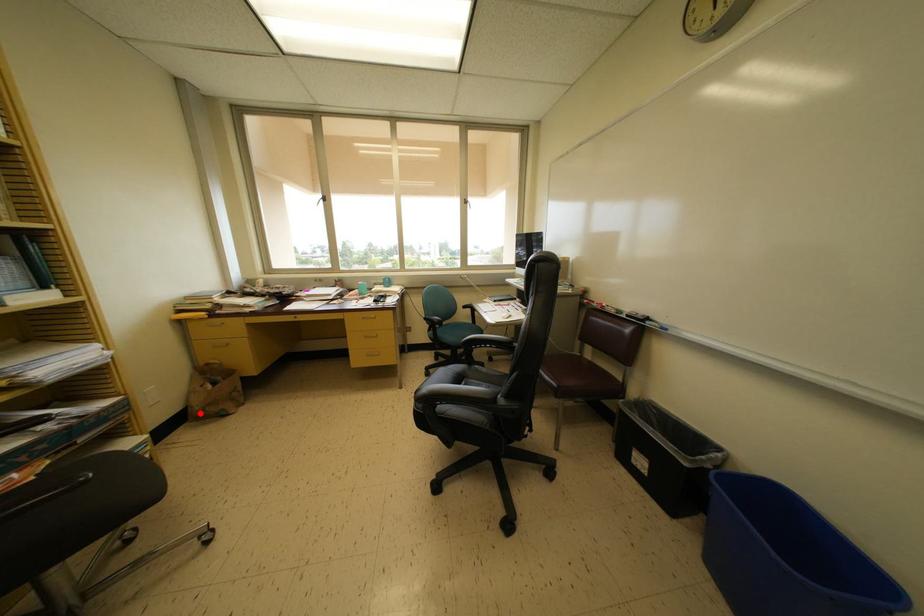
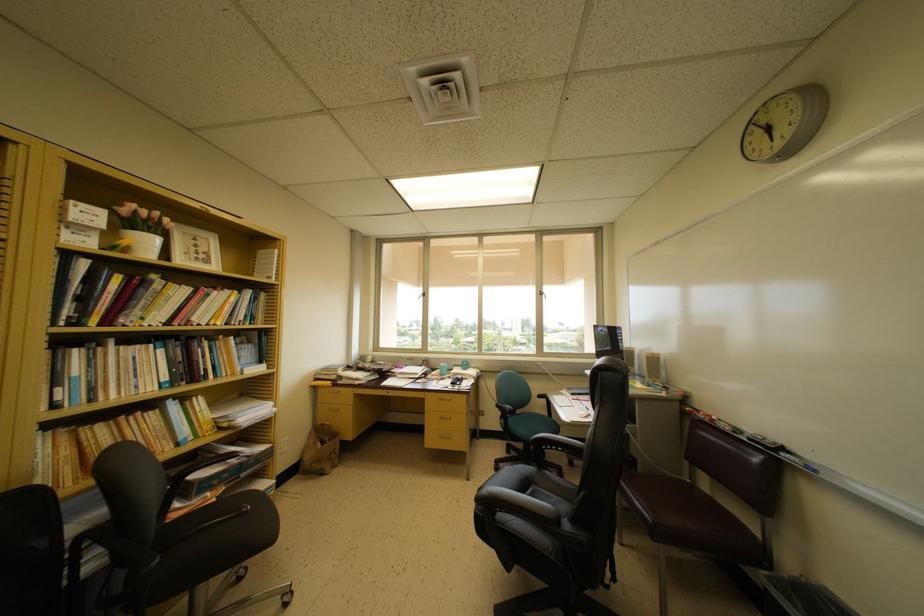
Question: A red point is marked in image1. In image2, is the corresponding 3D point closer to the camera or farther? Reply with the corresponding letter.

Choices:
 (A) The corresponding 3D point is closer.
 (B) The corresponding 3D point is farther.

Answer: (B)